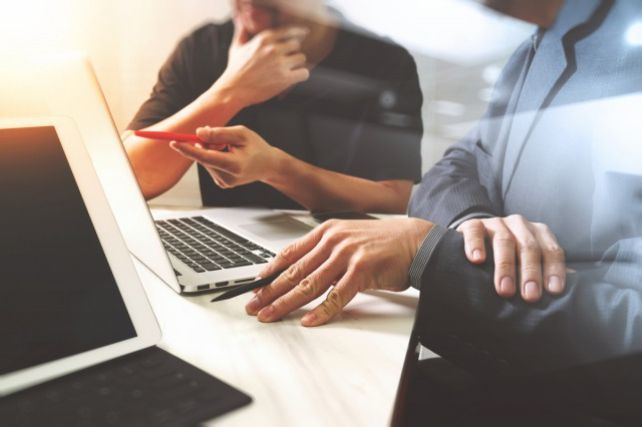
Locate an element on the screen. The image size is (642, 427). computers is located at coordinates pyautogui.click(x=130, y=278), pyautogui.click(x=160, y=259).